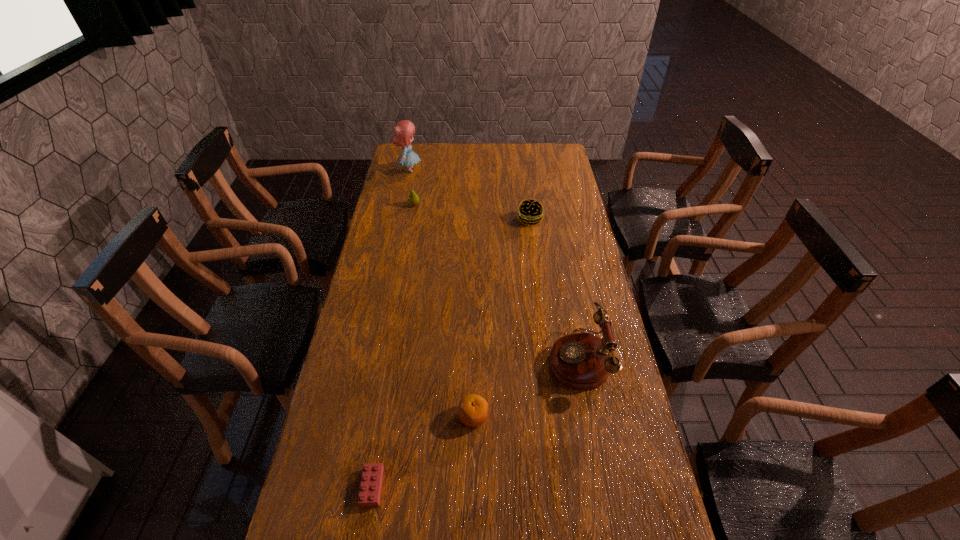
This screenshot has height=540, width=960. I want to click on free space that satisfies the following two spatial constraints: 1. on the front-facing side of the pear; 2. on the right side of the farthest object, so click(x=402, y=205).

Image resolution: width=960 pixels, height=540 pixels. Identify the location of vacant space that satisfies the following two spatial constraints: 1. on the front-facing side of the doll; 2. on the back side of the pear. (402, 205).

I want to click on free location that satisfies the following two spatial constraints: 1. on the back side of the nearest object; 2. on the front-facing side of the tallest object, so click(424, 170).

This screenshot has width=960, height=540. Identify the location of blank space that satisfies the following two spatial constraints: 1. on the front-facing side of the farthest object; 2. on the left side of the fifth farthest object. point(357,416).

Locate an element on the screen. The image size is (960, 540). free region that satisfies the following two spatial constraints: 1. on the front-facing side of the patty; 2. on the right side of the doll is located at coordinates (399, 220).

This screenshot has width=960, height=540. Identify the location of free spot that satisfies the following two spatial constraints: 1. on the front-facing side of the doll; 2. on the left side of the Lego. (343, 487).

Identify the location of vacant area in the image that satisfies the following two spatial constraints: 1. on the front-facing side of the farthest object; 2. on the right side of the shortest object. The width and height of the screenshot is (960, 540). (343, 487).

Find the location of a particular element. The image size is (960, 540). vacant area that satisfies the following two spatial constraints: 1. on the front-facing side of the farthest object; 2. on the back side of the fourth nearest object is located at coordinates (399, 220).